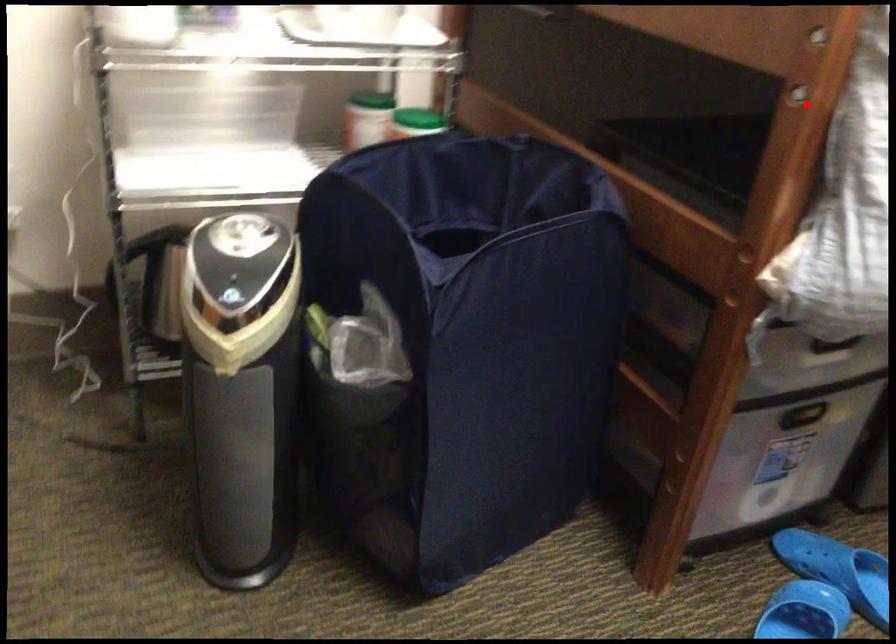
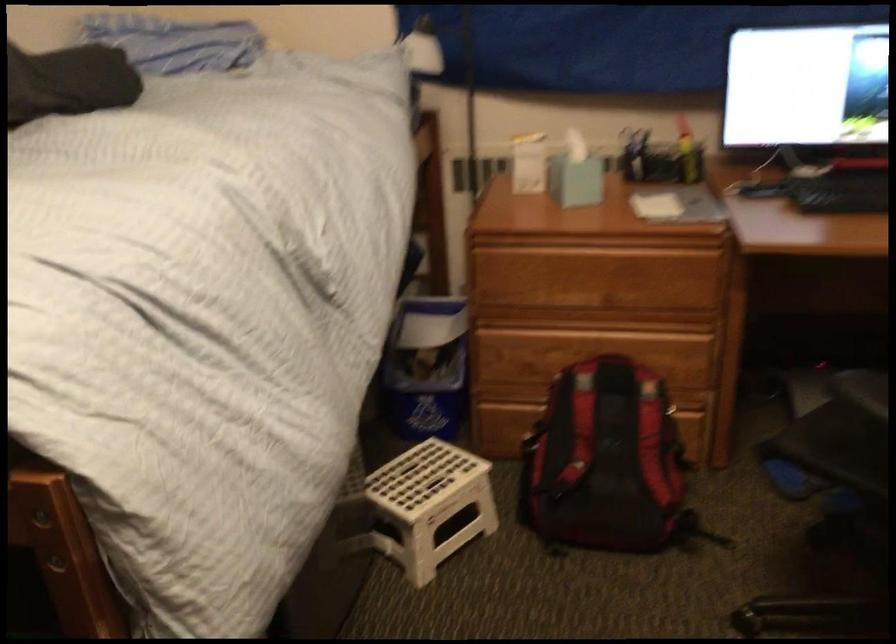
Find the pixel in the second image that matches the highlighted location in the first image.

(56, 567)